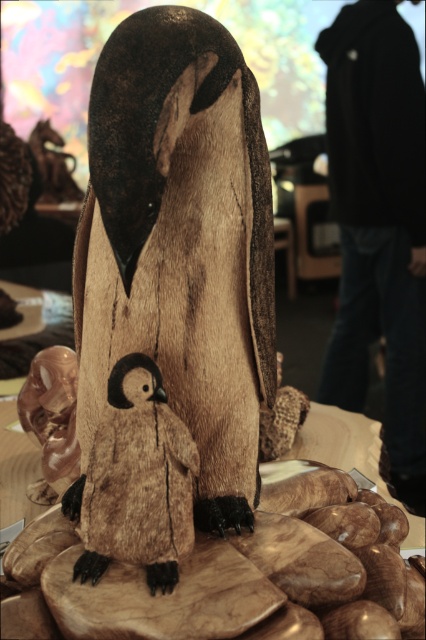
You are an art curator examining the penguin sculpture. You need to determine which penguin is shorter between the brown fuzzy penguin at center and the translucent amber penguin at lower left. Which one is shorter?

The brown fuzzy penguin at center is shorter than the translucent amber penguin at lower left.

You are standing in front of the wooden sculpture of a penguin family. There is a point marked at coordinates [181,243]. Which object does this point correspond to?

The point at coordinates [181,243] corresponds to the wooden penguin at center.